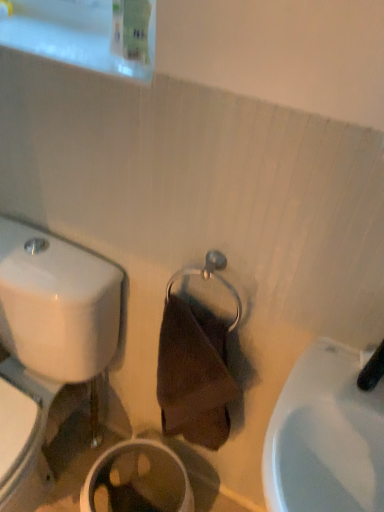
Question: From the image's perspective, relative to white glossy toilet at left, is black rubber faucet at upper right above or below?

Choices:
 (A) above
 (B) below

Answer: (A)

Question: Is black rubber faucet at upper right situated inside white glossy toilet at left or outside?

Choices:
 (A) outside
 (B) inside

Answer: (A)

Question: Which object is positioned farthest from the white glossy toilet at left?

Choices:
 (A) white glossy sink at lower right
 (B) black rubber faucet at upper right

Answer: (B)

Question: Estimate the real-world distances between objects in this image. Which object is farther from the white glossy toilet at left?

Choices:
 (A) white glossy sink at lower right
 (B) black rubber faucet at upper right

Answer: (B)